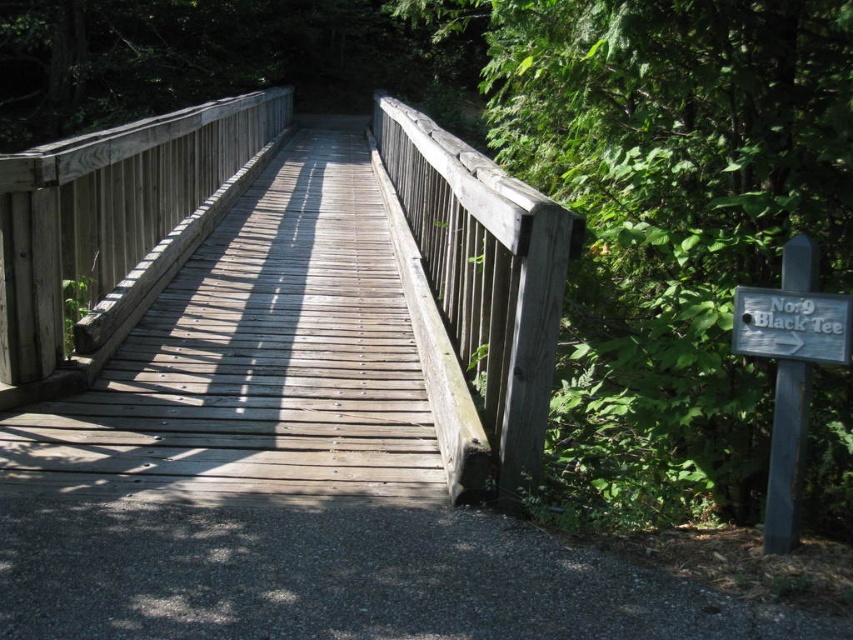
You are standing at the origin point of the image coordinate system, which is the bottom left corner. You want to cross the wooden bridge at center. What are the coordinates you need to move towards?

The coordinates to move towards are 0.459 on the x axis and 0.557 on the y axis since the wooden bridge at center is located at point [474,292].

What is the spatial relationship between the wooden bridge at center and the white wooden sign at right in the image?

The wooden bridge at center is located to the left of the white wooden sign at right.